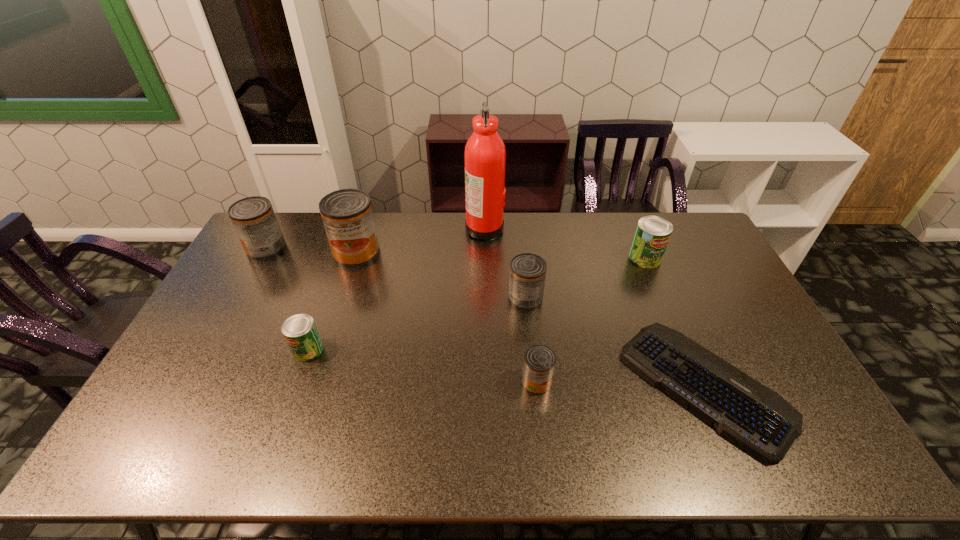
Find the location of a particular element. This screenshot has width=960, height=540. free location at the far edge is located at coordinates (471, 240).

I want to click on vacant space at the near edge, so click(379, 442).

Where is `blank space at the left edge of the desktop`? The width and height of the screenshot is (960, 540). blank space at the left edge of the desktop is located at coordinates (182, 407).

At what (x,y) coordinates should I click in order to perform the action: click on free space at the right edge of the desktop. Please return your answer as a coordinate pair (x, y). Image resolution: width=960 pixels, height=540 pixels. Looking at the image, I should click on [x=772, y=384].

Find the location of a particular element. The height and width of the screenshot is (540, 960). vacant region at the far left corner of the desktop is located at coordinates tap(293, 217).

Locate an element on the screen. The image size is (960, 540). vacant space at the near left corner is located at coordinates (156, 450).

Where is `vacant space in between the leftmost object and the second nearest can`? The width and height of the screenshot is (960, 540). vacant space in between the leftmost object and the second nearest can is located at coordinates (287, 299).

Where is `free space that is in between the shortest object and the tallest can`? The height and width of the screenshot is (540, 960). free space that is in between the shortest object and the tallest can is located at coordinates (531, 319).

Where is `free space between the nearest can and the fourth nearest object`? This screenshot has width=960, height=540. free space between the nearest can and the fourth nearest object is located at coordinates (531, 340).

You are a GUI agent. You are given a task and a screenshot of the screen. Output one action in this format:
    pyautogui.click(x=<x>, y=<y>)
    Task: Click on the vacant space that is in between the computer keyboard and the leftmost can
    This screenshot has height=540, width=960.
    Given the screenshot: What is the action you would take?
    pyautogui.click(x=486, y=317)